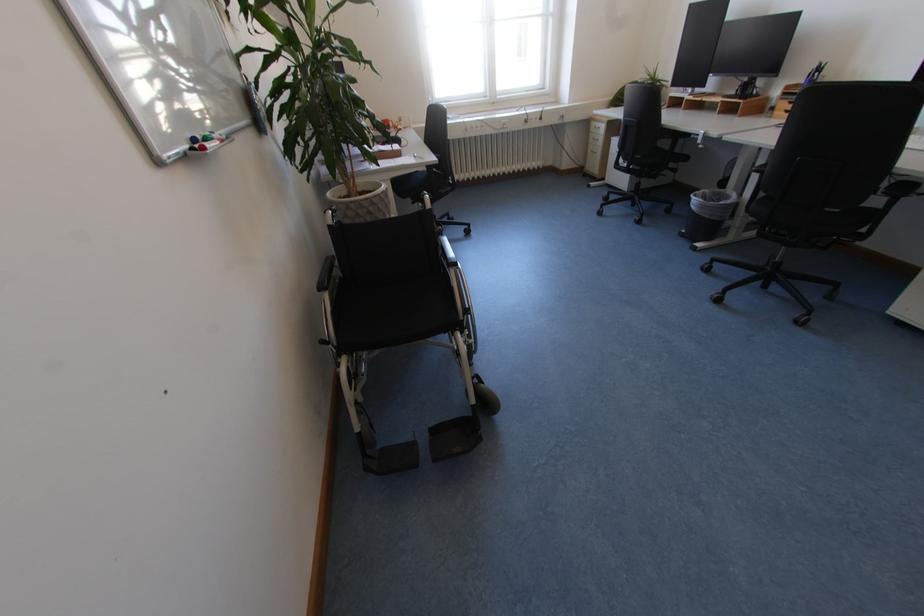
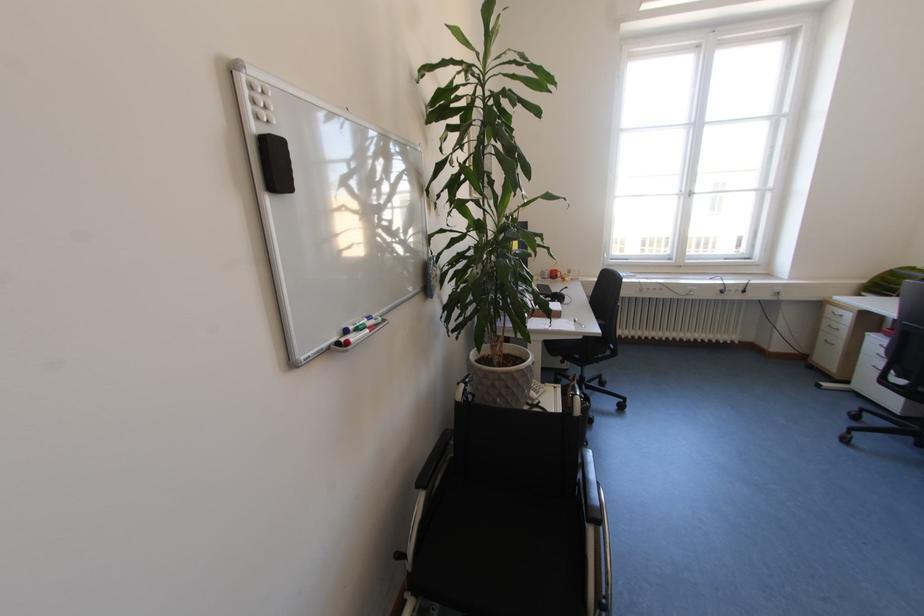
Find the pixel in the second image that matches point (459, 260) in the first image.

(602, 508)